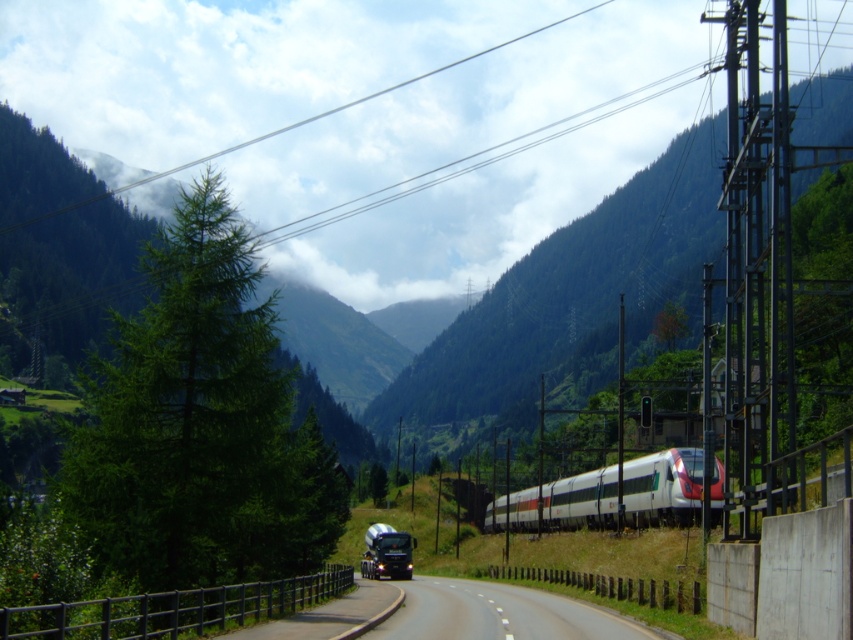
Question: Can you confirm if asphalt road at center is positioned to the right of white glossy passenger train at center-right?

Choices:
 (A) yes
 (B) no

Answer: (B)

Question: Is asphalt road at center closer to the viewer compared to white glossy passenger train at center-right?

Choices:
 (A) yes
 (B) no

Answer: (A)

Question: Which point is farther to the camera?

Choices:
 (A) (573, 499)
 (B) (409, 596)

Answer: (A)

Question: Is asphalt road at center positioned behind white glossy passenger train at center-right?

Choices:
 (A) yes
 (B) no

Answer: (B)